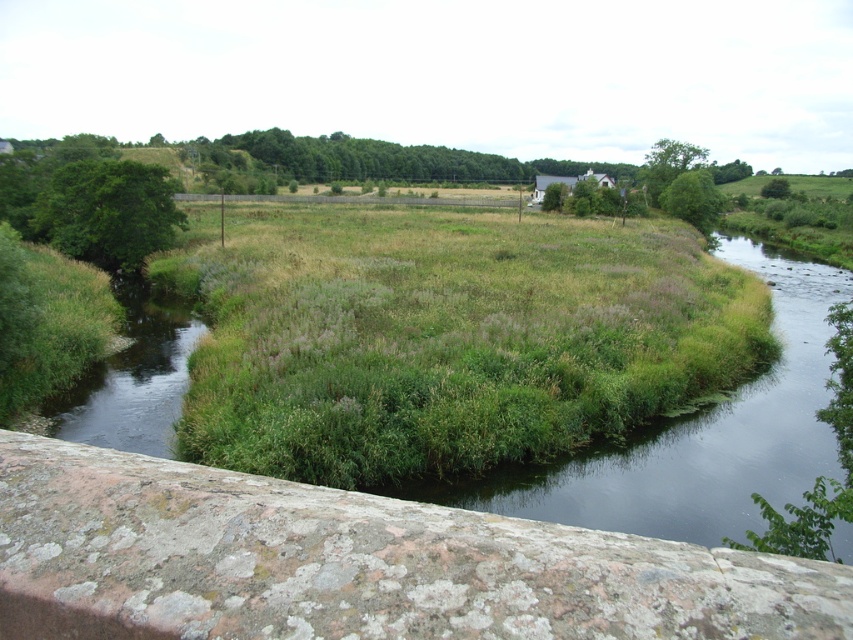
Question: Observing the image, what is the correct spatial positioning of green grassy patch at center in reference to green grassy stream at left?

Choices:
 (A) right
 (B) left

Answer: (A)

Question: Which object appears closest to the camera in this image?

Choices:
 (A) green grassy water at center
 (B) green grassy stream at left
 (C) green grassy patch at center

Answer: (A)

Question: Observing the image, what is the correct spatial positioning of green grassy patch at center in reference to green grassy water at center?

Choices:
 (A) below
 (B) above

Answer: (B)

Question: Which is nearer to the green grassy water at center?

Choices:
 (A) green grassy patch at center
 (B) green grassy stream at left

Answer: (A)

Question: Which of the following is the closest to the observer?

Choices:
 (A) green grassy stream at left
 (B) green grassy water at center
 (C) green grassy patch at center

Answer: (B)

Question: In this image, where is green grassy water at center located relative to green grassy stream at left?

Choices:
 (A) below
 (B) above

Answer: (B)